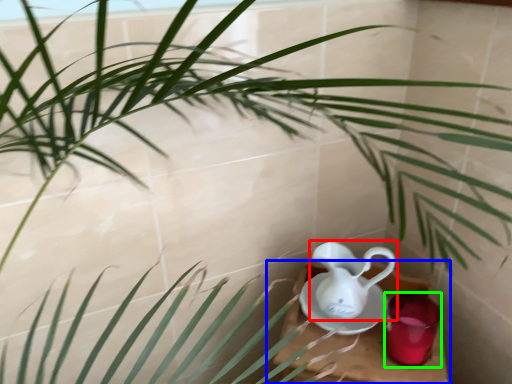
Question: Estimate the real-world distances between objects in this image. Which object is closer to jug (highlighted by a red box), table (highlighted by a blue box) or tableware (highlighted by a green box)?

Choices:
 (A) table
 (B) tableware

Answer: (A)